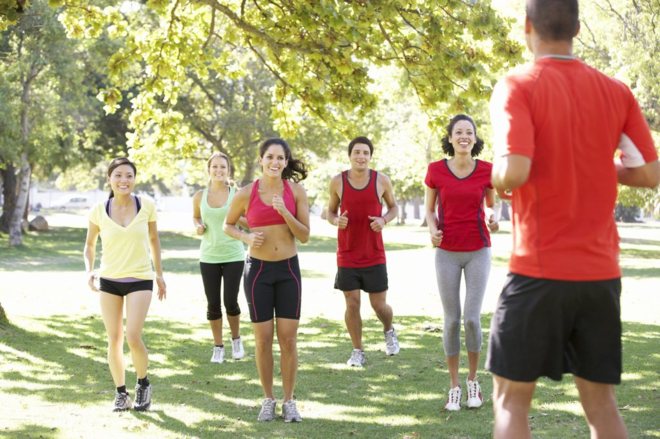
Find the location of a particular element. shoe is located at coordinates (472, 398), (447, 403), (389, 347), (354, 362), (294, 412), (267, 409), (236, 351), (208, 358), (145, 398), (121, 397).